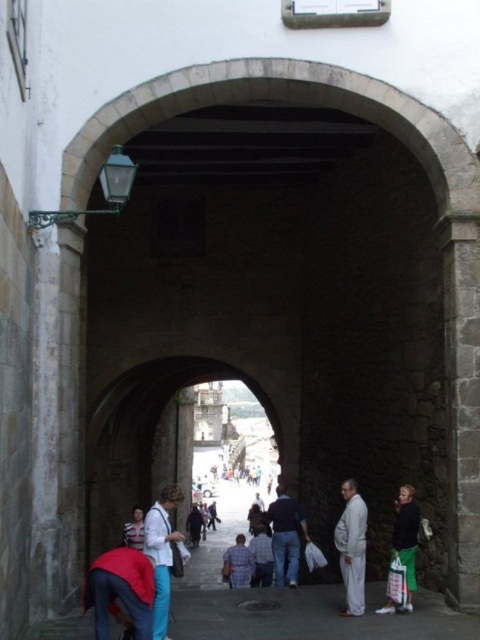
Question: Does dark blue jeans at center appear over plaid shirt at center?

Choices:
 (A) yes
 (B) no

Answer: (A)

Question: Among these points, which one is nearest to the camera?

Choices:
 (A) (164, 566)
 (B) (233, 577)
 (C) (116, 563)
 (D) (124, 529)

Answer: (C)

Question: Which of the following is the farthest from the observer?

Choices:
 (A) dark green pants at lower right
 (B) plaid shirt at center
 (C) light gray fabric pants at lower right
 (D) dark blue jeans at center

Answer: (B)

Question: Which point appears farthest from the camera in this image?

Choices:
 (A) (167, 566)
 (B) (409, 554)
 (C) (143, 531)
 (D) (240, 580)

Answer: (D)

Question: Does dark blue jeans at center come behind light brown leather jacket at lower left?

Choices:
 (A) yes
 (B) no

Answer: (B)

Question: Can you confirm if dark green pants at lower right is wider than light brown leather jacket at lower left?

Choices:
 (A) yes
 (B) no

Answer: (B)